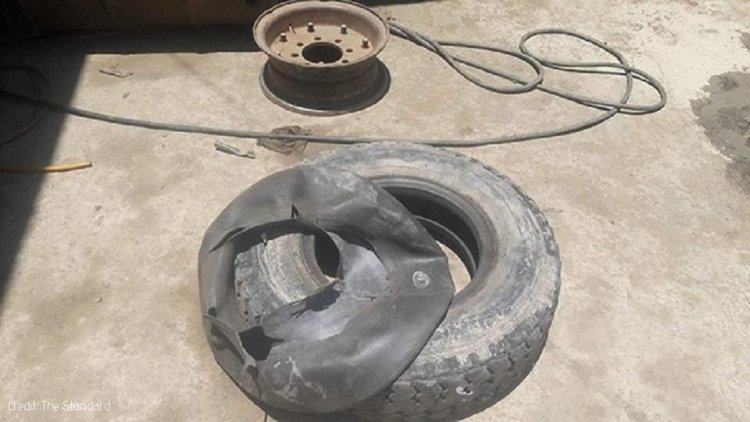
Find the location of a particular element. The image size is (750, 422). dark spot on floor is located at coordinates pos(728,114).